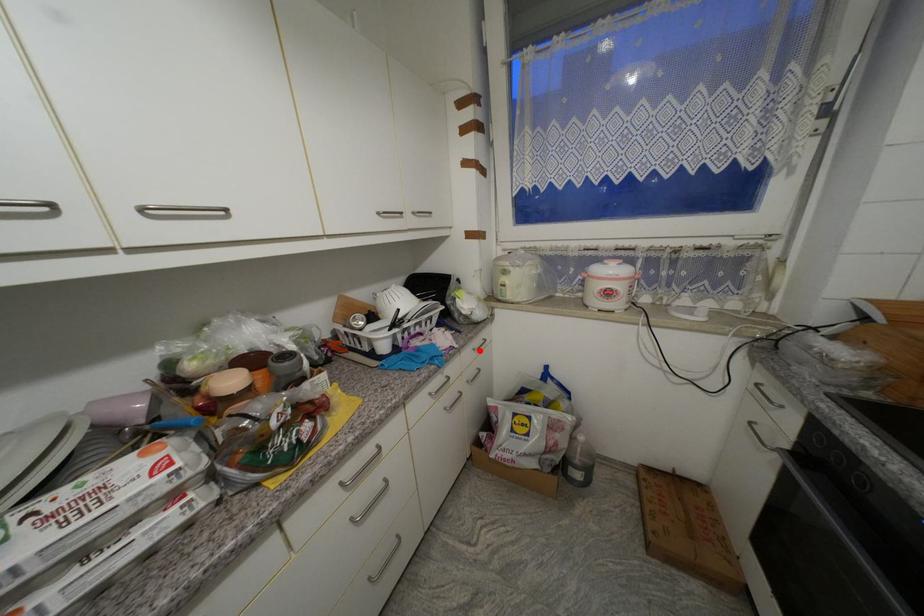
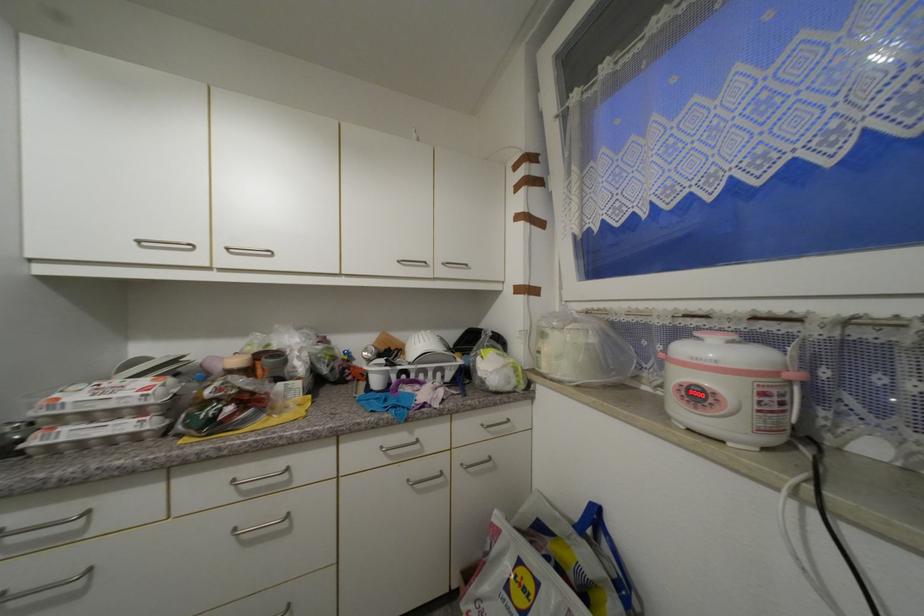
Question: I am providing you with two images of the same scene from different viewpoints. A red point is marked on the first image. Is the red point's position out of view in image 2?

Choices:
 (A) Yes
 (B) No

Answer: (B)